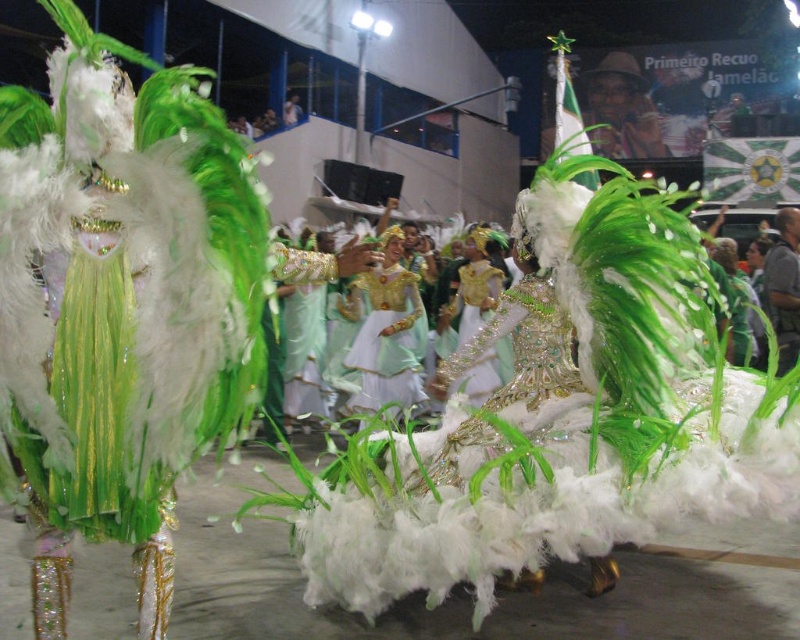
Can you confirm if green feathered costume at center is positioned below matte green dress at center?

Yes.

Locate an element on the screen. Image resolution: width=800 pixels, height=640 pixels. green feathered costume at center is located at coordinates (121, 304).

Does green feathered costume at center appear on the right side of shiny gold dress at center?

In fact, green feathered costume at center is to the left of shiny gold dress at center.

Does green feathered costume at center lie behind shiny gold dress at center?

That is False.

You are a GUI agent. You are given a task and a screenshot of the screen. Output one action in this format:
    pyautogui.click(x=<x>, y=<y>)
    Task: Click on the green feathered costume at center
    The image size is (800, 640).
    Given the screenshot: What is the action you would take?
    pyautogui.click(x=121, y=304)

Who is more forward, (385, 275) or (484, 291)?

Point (484, 291)

Can you confirm if matte green dress at center is positioned above shiny gold dress at center?

Actually, matte green dress at center is below shiny gold dress at center.

At what (x,y) coordinates should I click in order to perform the action: click on matte green dress at center. Please return your answer as a coordinate pair (x, y). This screenshot has width=800, height=640. Looking at the image, I should click on (386, 333).

Locate an element on the screen. The height and width of the screenshot is (640, 800). matte green dress at center is located at coordinates (386, 333).